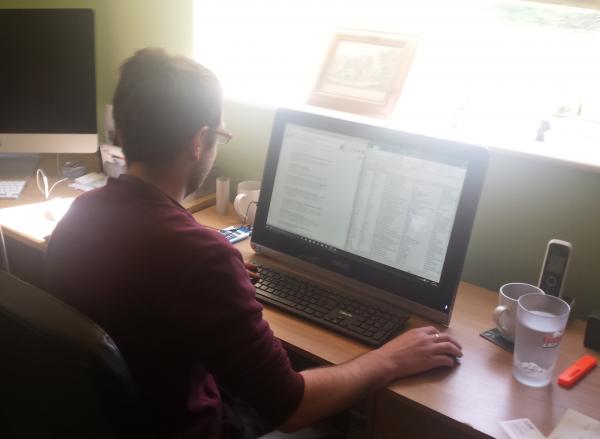
Identify the location of computer monitor. (365, 186).